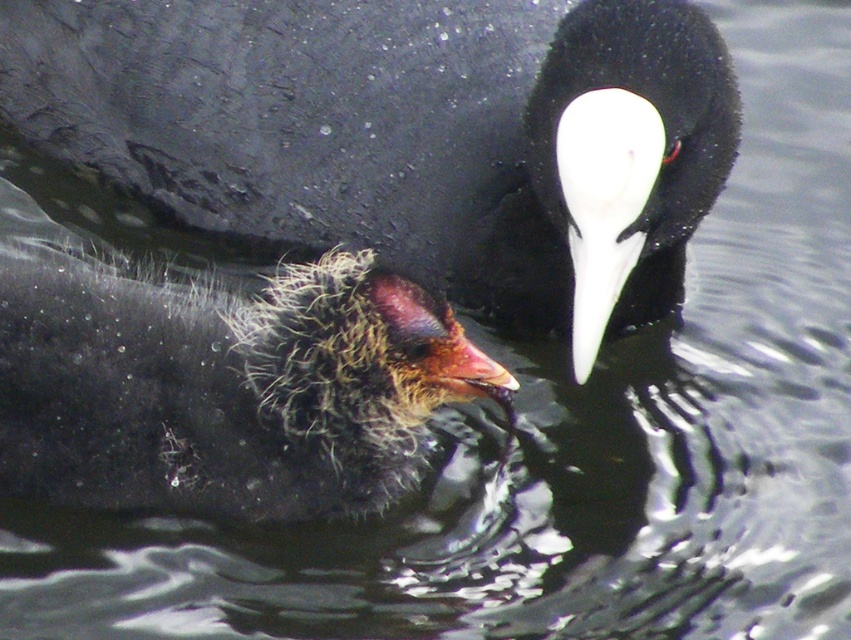
Is fluffy downy chick at center to the right of white glossy beak at center from the viewer's perspective?

In fact, fluffy downy chick at center is to the left of white glossy beak at center.

Image resolution: width=851 pixels, height=640 pixels. Describe the element at coordinates (220, 388) in the screenshot. I see `fluffy downy chick at center` at that location.

Identify the location of fluffy downy chick at center. The height and width of the screenshot is (640, 851). (220, 388).

Does white glossy beak at center have a greater height compared to smooth red beak at center?

Yes.

You are a GUI agent. You are given a task and a screenshot of the screen. Output one action in this format:
    pyautogui.click(x=<x>, y=<y>)
    Task: Click on the white glossy beak at center
    This screenshot has height=640, width=851.
    Given the screenshot: What is the action you would take?
    pyautogui.click(x=597, y=280)

In the scene shown: Can you confirm if white matte beak at center is positioned to the left of smooth red beak at center?

No, white matte beak at center is not to the left of smooth red beak at center.

Which of these two, white matte beak at center or smooth red beak at center, stands shorter?

smooth red beak at center is shorter.

Does point (623, 154) come behind point (446, 376)?

No, it is not.

Locate an element on the screen. white matte beak at center is located at coordinates (627, 145).